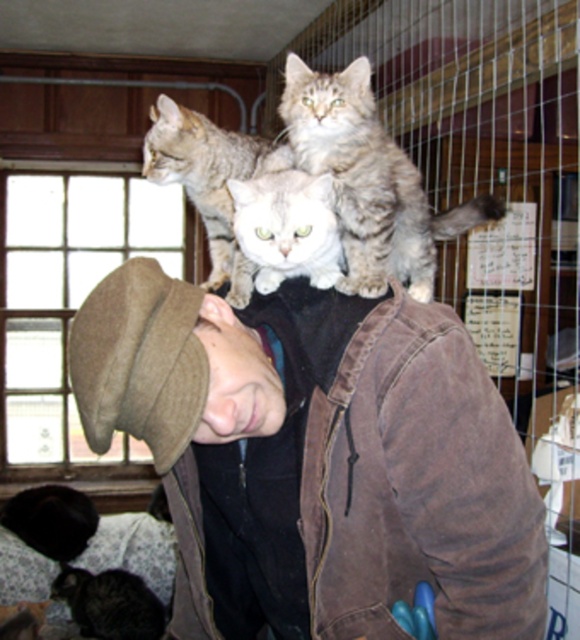
You are a photographer trying to capture a clear shot of the black fur head at lower left. However, the brown suede jacket at center is blocking your view. Can you move the jacket to get a clear shot?

The brown suede jacket at center is in front of the black fur head at lower left, so moving the jacket would allow you to see the black fur head at lower left clearly.

You are a photographer trying to capture a candid shot of the person in the brown suede jacket at center and the black fur head at lower left. Since you want to focus on both subjects, which one should you adjust your camera lens to focus on first considering their positions?

The brown suede jacket at center is above the black fur head at lower left, so you should focus on the brown suede jacket at center first as it is higher up and closer to the camera.

You are an animal caretaker assessing the space needed for two animals in the scene. The tabby fur cat at center and the black fur head at lower left. Which animal requires more horizontal space due to its greater width?

The tabby fur cat at center requires more horizontal space because its width surpasses that of the black fur head at lower left.